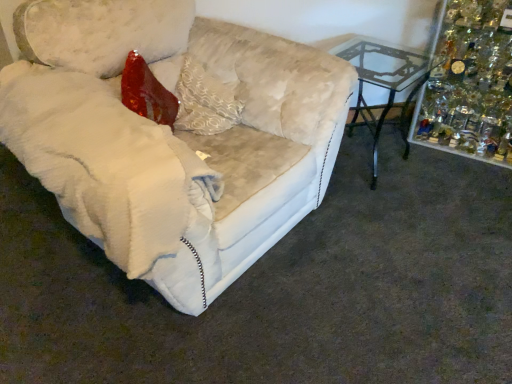
Find the location of `white textured pillow at center`. white textured pillow at center is located at coordinates (204, 101).

What are the coordinates of `clear glass table at center right` in the screenshot? It's located at (384, 86).

From the image's perspective, is white plush couch at left positioned above or below white textured pillow at center?

white plush couch at left is situated lower than white textured pillow at center in the image.

Which object is more forward, white plush couch at left or white textured pillow at center?

white plush couch at left is in front.

Would you say white plush couch at left is a long distance from white textured pillow at center?

Actually, white plush couch at left and white textured pillow at center are a little close together.

Does white plush couch at left have a smaller size compared to clear glass table at center right?

No.

From the picture: Is white plush couch at left oriented away from clear glass table at center right?

That's not correct — white plush couch at left is not looking away from clear glass table at center right.

From a real-world perspective, between white plush couch at left and clear glass table at center right, who is vertically higher?

white plush couch at left.

In the scene shown: Can you confirm if white plush couch at left is positioned to the left of clear glass table at center right?

Yes, white plush couch at left is to the left of clear glass table at center right.

Is white textured pillow at center to the left or to the right of white plush couch at left in the image?

Based on their positions, white textured pillow at center is located to the right of white plush couch at left.

Considering the positions of objects white textured pillow at center and white plush couch at left in the image provided, who is in front, white textured pillow at center or white plush couch at left?

white plush couch at left is closer to the camera.

Are white textured pillow at center and white plush couch at left far apart?

No, white textured pillow at center is not far from white plush couch at left.

Considering the sizes of white textured pillow at center and white plush couch at left in the image, is white textured pillow at center taller or shorter than white plush couch at left?

Considering their sizes, white textured pillow at center has less height than white plush couch at left.

Is clear glass table at center right located outside white textured pillow at center?

clear glass table at center right lies outside white textured pillow at center's area.

Find the location of `table behind the white textured pillow at center`. table behind the white textured pillow at center is located at coordinates (384, 86).

Which of these two, clear glass table at center right or white textured pillow at center, is smaller?

white textured pillow at center is smaller.

Is clear glass table at center right facing away from white textured pillow at center?

No.

Which object is thinner, white textured pillow at center or clear glass table at center right?

white textured pillow at center.

Can you tell me how much white textured pillow at center and clear glass table at center right differ in facing direction?

There is a 14.3-degree angle between the facing directions of white textured pillow at center and clear glass table at center right.

From a real-world perspective, between white textured pillow at center and clear glass table at center right, who is vertically lower?

clear glass table at center right.

Based on their positions, is white textured pillow at center located to the left or right of clear glass table at center right?

white textured pillow at center is positioned on clear glass table at center right's left side.

Considering the points (503, 93) and (400, 67), which point is in front, point (503, 93) or point (400, 67)?

Positioned in front is point (400, 67).

From the image's perspective, is shiny glass ornaments at upper right positioned above or below clear glass table at center right?

Based on their image positions, shiny glass ornaments at upper right is located above clear glass table at center right.

From a real-world perspective, between shiny glass ornaments at upper right and clear glass table at center right, who is vertically higher?

shiny glass ornaments at upper right.

Can you confirm if shiny glass ornaments at upper right is positioned to the left of clear glass table at center right?

In fact, shiny glass ornaments at upper right is to the right of clear glass table at center right.

Considering the sizes of white textured pillow at center and shiny glass ornaments at upper right in the image, is white textured pillow at center wider or thinner than shiny glass ornaments at upper right?

Clearly, white textured pillow at center has less width compared to shiny glass ornaments at upper right.

Considering the relative positions of white textured pillow at center and shiny glass ornaments at upper right in the image provided, is white textured pillow at center to the left or to the right of shiny glass ornaments at upper right?

Clearly, white textured pillow at center is on the left of shiny glass ornaments at upper right in the image.

What's the angular difference between white textured pillow at center and shiny glass ornaments at upper right's facing directions?

83.8 degrees.

This screenshot has height=384, width=512. In order to click on studio couch that is in front of the white textured pillow at center in this screenshot , I will do `click(173, 136)`.

I want to click on studio couch above the clear glass table at center right (from a real-world perspective), so click(x=173, y=136).

Considering their positions, is clear glass table at center right positioned further to white textured pillow at center than shiny glass ornaments at upper right?

shiny glass ornaments at upper right is further to white textured pillow at center.

Based on their spatial positions, is white textured pillow at center or shiny glass ornaments at upper right further from white plush couch at left?

shiny glass ornaments at upper right is positioned further to the anchor white plush couch at left.

Estimate the real-world distances between objects in this image. Which object is closer to shiny glass ornaments at upper right, white textured pillow at center or clear glass table at center right?

clear glass table at center right.

When comparing their distances from white textured pillow at center, does shiny glass ornaments at upper right or white plush couch at left seem closer?

Among the two, white plush couch at left is located nearer to white textured pillow at center.

Consider the image. From the image, which object appears to be farther from clear glass table at center right, white textured pillow at center or shiny glass ornaments at upper right?

Among the two, white textured pillow at center is located further to clear glass table at center right.

Estimate the real-world distances between objects in this image. Which object is further from shiny glass ornaments at upper right, white plush couch at left or white textured pillow at center?

The object further to shiny glass ornaments at upper right is white textured pillow at center.

From the image, which object appears to be farther from white plush couch at left, shiny glass ornaments at upper right or white textured pillow at center?

shiny glass ornaments at upper right is further to white plush couch at left.

Looking at this image, considering their positions, is clear glass table at center right positioned further to white plush couch at left than white textured pillow at center?

clear glass table at center right is further to white plush couch at left.

At what (x,y) coordinates should I click in order to perform the action: click on pillow between white plush couch at left and shiny glass ornaments at upper right from left to right. Please return your answer as a coordinate pair (x, y). The height and width of the screenshot is (384, 512). Looking at the image, I should click on (204, 101).

This screenshot has height=384, width=512. In order to click on pillow between white plush couch at left and clear glass table at center right from left to right in this screenshot , I will do `click(204, 101)`.

Where is `table between white textured pillow at center and shiny glass ornaments at upper right from left to right`? table between white textured pillow at center and shiny glass ornaments at upper right from left to right is located at coordinates (384, 86).

You are a GUI agent. You are given a task and a screenshot of the screen. Output one action in this format:
    pyautogui.click(x=<x>, y=<y>)
    Task: Click on the table between white plush couch at left and shiny glass ornaments at upper right in the horizontal direction
    The width and height of the screenshot is (512, 384).
    Given the screenshot: What is the action you would take?
    pyautogui.click(x=384, y=86)